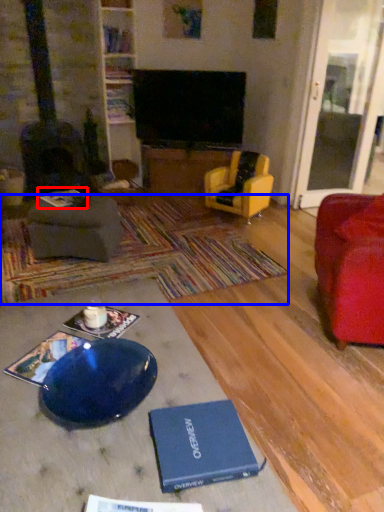
Question: Which of the following is the closest to the observer, book (highlighted by a red box) or mat (highlighted by a blue box)?

Choices:
 (A) book
 (B) mat

Answer: (B)